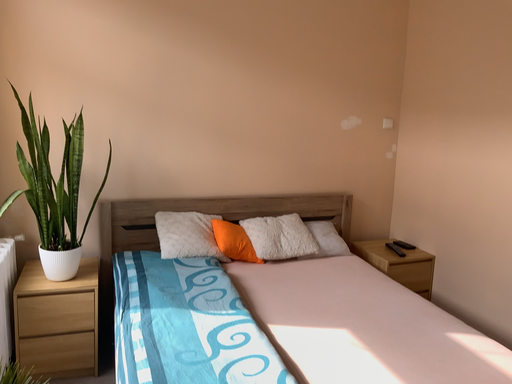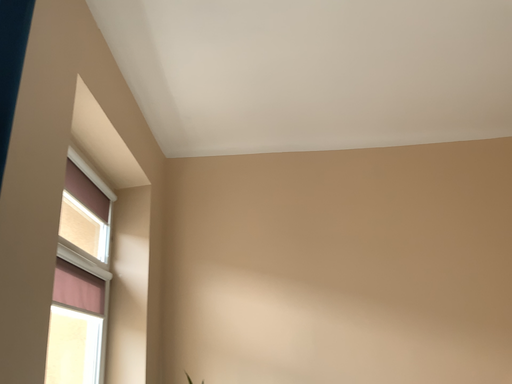
Question: How did the camera likely rotate when shooting the video?

Choices:
 (A) rotated downward
 (B) rotated upward

Answer: (B)